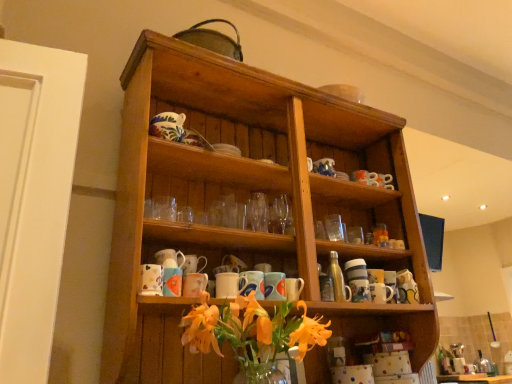
Question: Is matte ceramic mug at center, which ranks as the 7th mug in left-to-right order, positioned before matte ceramic mug at center, which appears as the second mug when viewed from the left?

Choices:
 (A) yes
 (B) no

Answer: (B)

Question: Is matte ceramic mug at center, which ranks as the 7th mug in left-to-right order, at the right side of matte ceramic mug at center, which appears as the second mug when viewed from the left?

Choices:
 (A) no
 (B) yes

Answer: (B)

Question: Can you confirm if matte ceramic mug at center, positioned as the 1th mug in right-to-left order, is shorter than matte ceramic mug at center, which appears as the 6th mug when viewed from the right?

Choices:
 (A) yes
 (B) no

Answer: (B)

Question: From the image's perspective, is matte ceramic mug at center, positioned as the 1th mug in right-to-left order, beneath matte ceramic mug at center, which appears as the 6th mug when viewed from the right?

Choices:
 (A) no
 (B) yes

Answer: (B)

Question: Could you tell me if matte ceramic mug at center, which ranks as the 7th mug in left-to-right order, is facing matte ceramic mug at center, which appears as the second mug when viewed from the left?

Choices:
 (A) yes
 (B) no

Answer: (B)

Question: Is matte ceramic mug at center, positioned as the 1th mug in right-to-left order, looking in the opposite direction of matte ceramic mug at center, which appears as the 6th mug when viewed from the right?

Choices:
 (A) yes
 (B) no

Answer: (B)

Question: Can you confirm if matte ceramic mug at center, the second mug positioned from the right, is bigger than metallic silver bottle at center-right?

Choices:
 (A) yes
 (B) no

Answer: (B)

Question: Can you confirm if matte ceramic mug at center, acting as the sixth mug starting from the left, is thinner than metallic silver bottle at center-right?

Choices:
 (A) yes
 (B) no

Answer: (B)

Question: Is metallic silver bottle at center-right at the back of matte ceramic mug at center, acting as the sixth mug starting from the left?

Choices:
 (A) yes
 (B) no

Answer: (B)

Question: Is matte ceramic mug at center, acting as the sixth mug starting from the left, completely or partially outside of metallic silver bottle at center-right?

Choices:
 (A) yes
 (B) no

Answer: (A)

Question: Is matte ceramic mug at center, acting as the sixth mug starting from the left, far from metallic silver bottle at center-right?

Choices:
 (A) no
 (B) yes

Answer: (A)

Question: From a real-world perspective, is matte ceramic mug at center, the second mug positioned from the right, located beneath metallic silver bottle at center-right?

Choices:
 (A) yes
 (B) no

Answer: (A)

Question: Does matte ceramic mug at center, the second mug positioned from the right, contain matte ceramic mug at center, which appears as the 6th mug when viewed from the right?

Choices:
 (A) no
 (B) yes

Answer: (A)